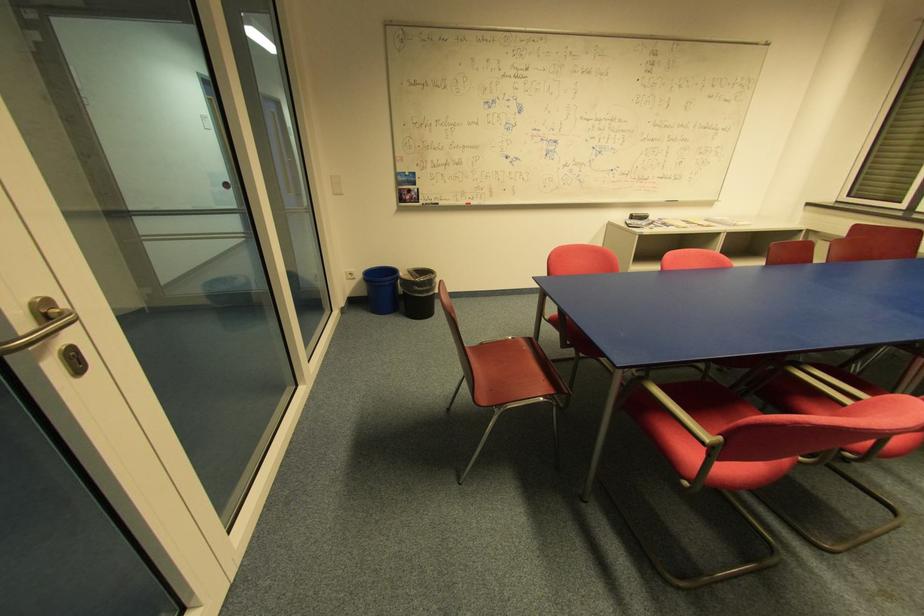
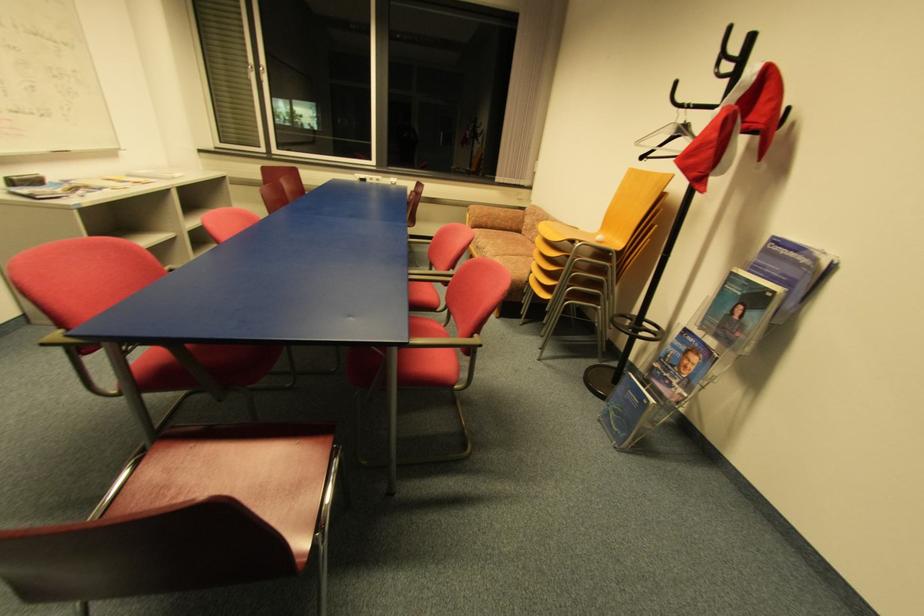
The first image is from the beginning of the video and the second image is from the end. How did the camera likely rotate when shooting the video?

The camera's rotation is toward right-down.